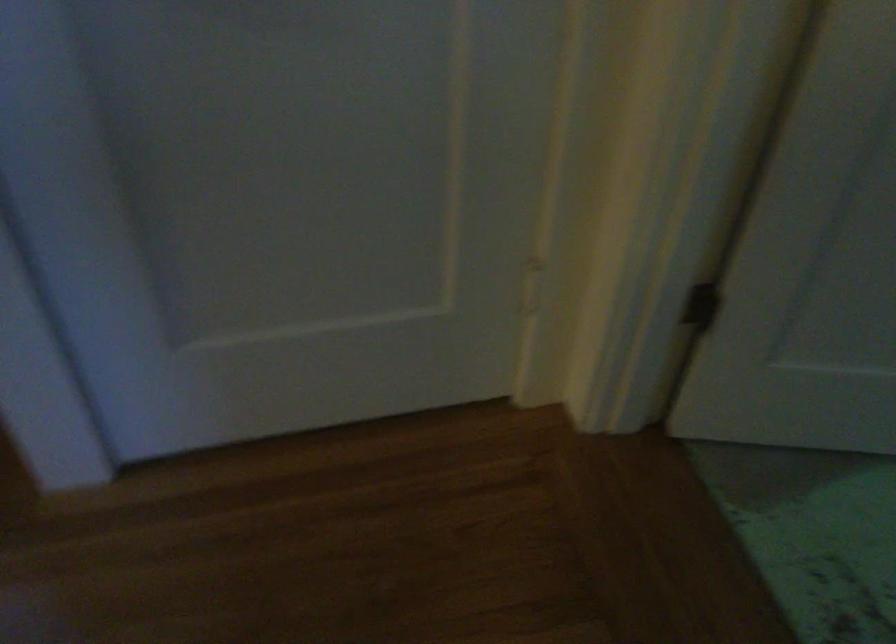
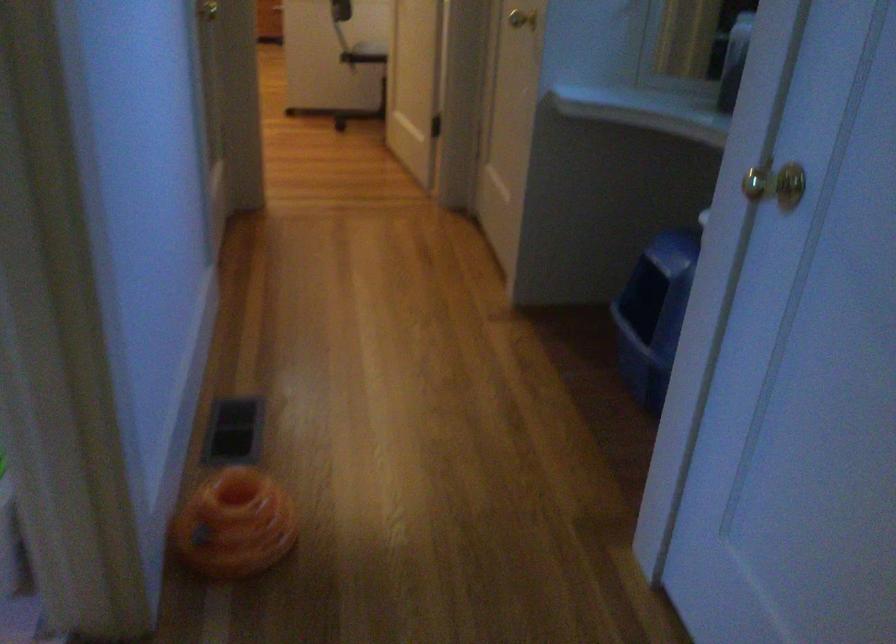
First-person continuous shooting, in which direction is the camera rotating?

The camera's rotation is toward left-down.